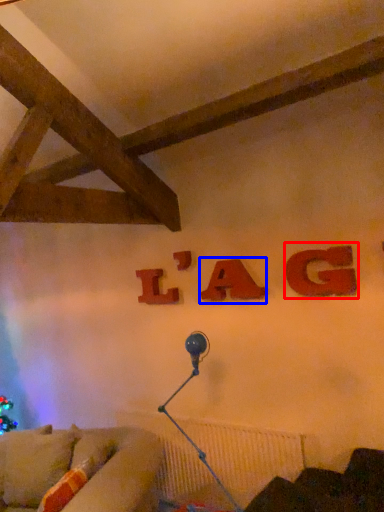
Question: Among these objects, which one is farthest to the camera, alphabet (highlighted by a red box) or alphabet (highlighted by a blue box)?

Choices:
 (A) alphabet
 (B) alphabet

Answer: (B)